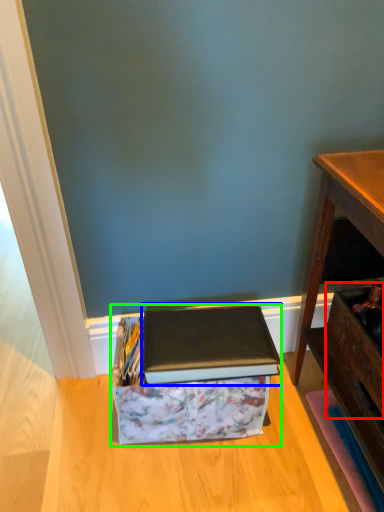
Question: Which object is positioned farthest from drawer (highlighted by a red box)? Select from paperback book (highlighted by a blue box) and storage box (highlighted by a green box).

Choices:
 (A) paperback book
 (B) storage box

Answer: (B)